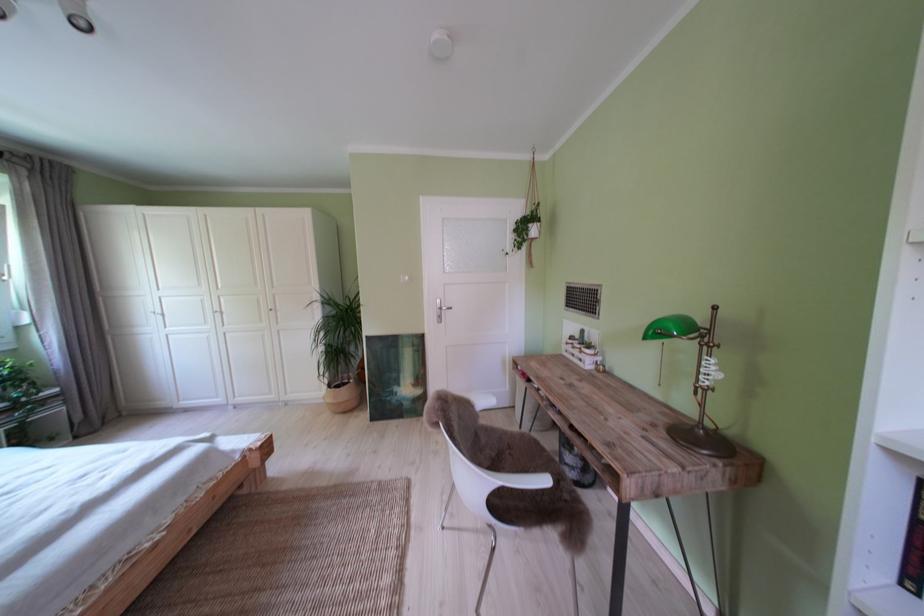
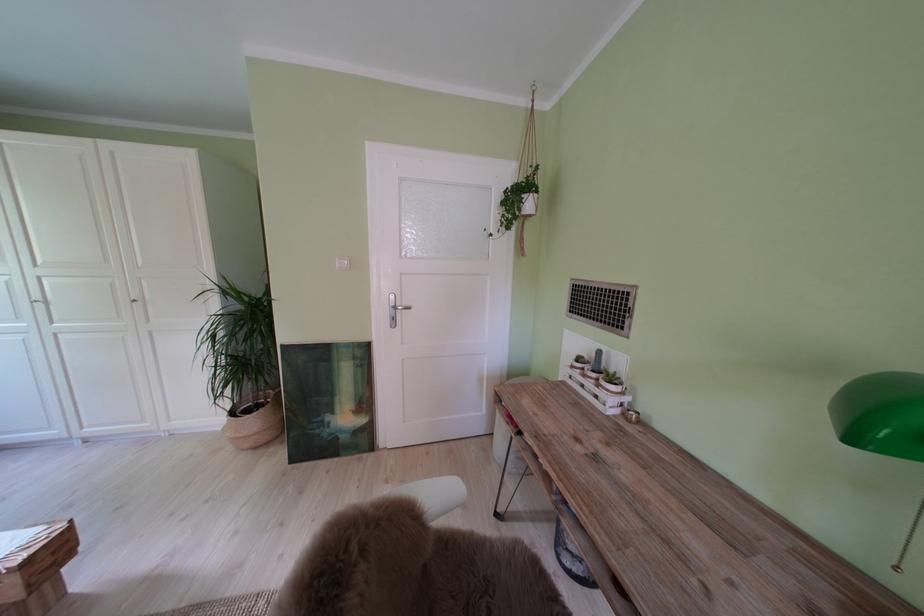
Question: In a continuous first-person perspective shot, in which direction is the camera moving?

Choices:
 (A) Left
 (B) Right
 (C) Forward
 (D) Backward

Answer: (C)